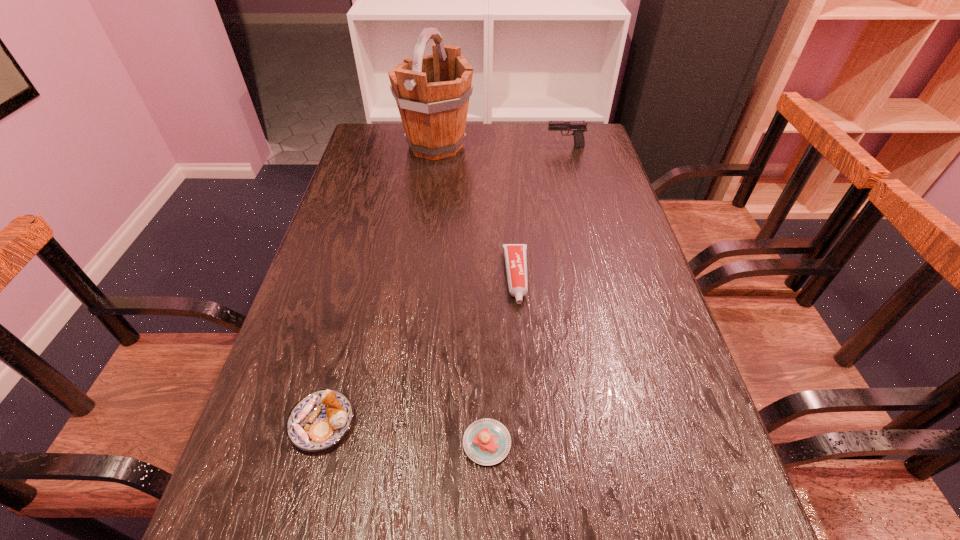
Find the location of a particular element. The height and width of the screenshot is (540, 960). vacant space in between the third nearest object and the tallest object is located at coordinates (476, 212).

Where is `vacant area between the tallest object and the left pastry`? The image size is (960, 540). vacant area between the tallest object and the left pastry is located at coordinates (379, 284).

What are the coordinates of `free space that is in between the shorter pastry and the taller pastry` in the screenshot? It's located at (404, 433).

Locate an element on the screen. empty space that is in between the left pastry and the shorter pastry is located at coordinates (404, 433).

Locate an element on the screen. Image resolution: width=960 pixels, height=540 pixels. vacant space in between the right pastry and the second object from right to left is located at coordinates (502, 360).

Choose which object is the second nearest neighbor to the taller pastry. Please provide its 2D coordinates. Your answer should be formatted as a tuple, i.e. [(x, y)], where the tuple contains the x and y coordinates of a point satisfying the conditions above.

[(515, 254)]

Identify the location of object that can be found as the second closest to the fourth shortest object. The width and height of the screenshot is (960, 540). (515, 254).

Locate an element on the screen. The width and height of the screenshot is (960, 540). vacant space that satisfies the following two spatial constraints: 1. aim along the barrel of the rightmost object; 2. at the nozzle of the second object from right to left is located at coordinates (599, 277).

This screenshot has width=960, height=540. Identify the location of free space that satisfies the following two spatial constraints: 1. on the back side of the taller pastry; 2. on the right side of the tallest object. (395, 146).

Find the location of a particular element. free spot that satisfies the following two spatial constraints: 1. aim along the barrel of the fourth shortest object; 2. at the nozzle of the third farthest object is located at coordinates (599, 277).